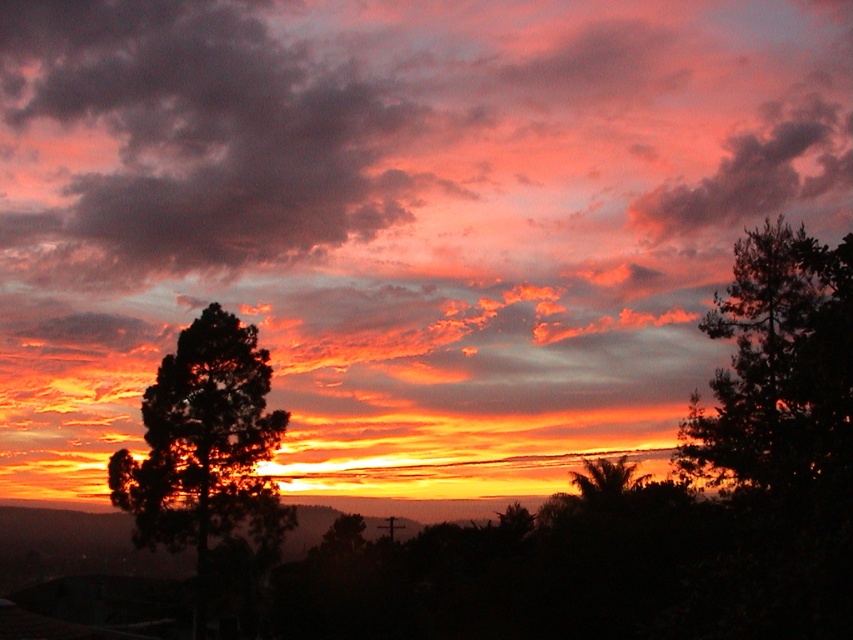
Who is more forward, [96,154] or [210,330]?

Positioned in front is point [210,330].

Can you confirm if dark pink cotton clouds at upper center is positioned to the left of dark green leafy tree at left?

Correct, you'll find dark pink cotton clouds at upper center to the left of dark green leafy tree at left.

Who is more distant from viewer, (283,236) or (242,406)?

The point (283,236) is behind.

The height and width of the screenshot is (640, 853). I want to click on dark pink cotton clouds at upper center, so click(189, 141).

Does dark pink cotton clouds at upper center appear on the left side of dark green textured tree at right?

Correct, you'll find dark pink cotton clouds at upper center to the left of dark green textured tree at right.

Consider the image. Is dark pink cotton clouds at upper center smaller than dark green textured tree at right?

No, dark pink cotton clouds at upper center is not smaller than dark green textured tree at right.

Find the location of a particular element. dark pink cotton clouds at upper center is located at coordinates (189, 141).

Can you confirm if dark green textured tree at right is positioned to the left of dark green leafy tree at left?

No, dark green textured tree at right is not to the left of dark green leafy tree at left.

Between dark green textured tree at right and dark green leafy tree at left, which one is positioned lower?

dark green leafy tree at left is below.

From the picture: Who is more distant from viewer, (740, 461) or (181, 538)?

Positioned behind is point (181, 538).

Where is `dark green textured tree at right`? This screenshot has width=853, height=640. dark green textured tree at right is located at coordinates (779, 374).